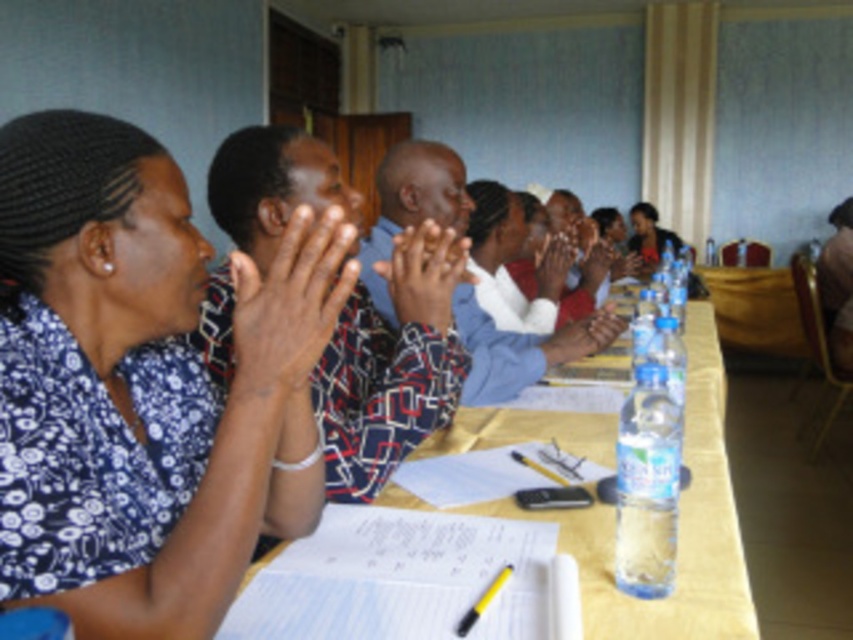
You are a photographer positioned at the end of the table in the meeting room. You need to capture a clear photo of both the dark brown skin at center and the matte skin hand at center. Considering their heights, which object should you adjust your camera angle upwards to focus on?

Since the dark brown skin at center has a lesser height compared to the matte skin hand at center, you should adjust your camera angle upwards to focus on the matte skin hand at center.

You are standing at the entrance of the meeting room and want to locate the yellow matte table at center. According to the coordinates provided, in which direction should you move from your current position to reach it?

The yellow matte table at center is located at coordinates point (677, 529), so you should move towards the lower right direction to reach it.